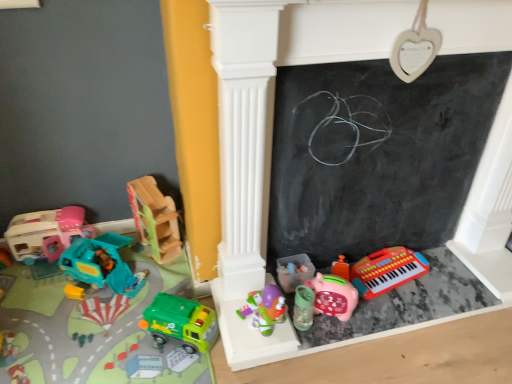
Where is `free spot above black chalkboard at center (from a real-world perspective)`? This screenshot has width=512, height=384. free spot above black chalkboard at center (from a real-world perspective) is located at coordinates (401, 59).